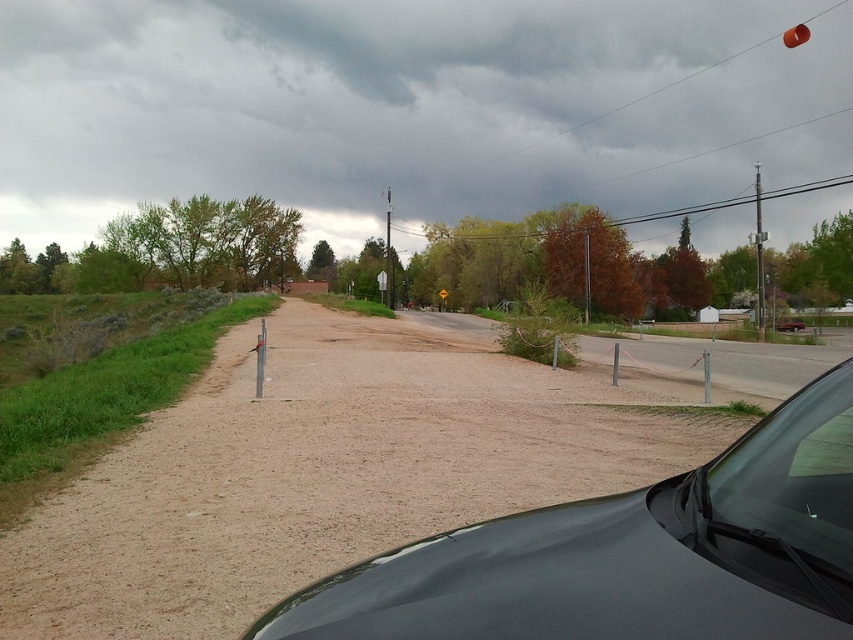
Between black glossy car at lower right and transparent glass windshield at lower right, which one appears on the right side from the viewer's perspective?

Positioned to the right is transparent glass windshield at lower right.

Who is positioned more to the left, black glossy car at lower right or transparent glass windshield at lower right?

black glossy car at lower right

Is point (508, 518) less distant than point (764, 486)?

No, it is not.

You are a GUI agent. You are given a task and a screenshot of the screen. Output one action in this format:
    pyautogui.click(x=<x>, y=<y>)
    Task: Click on the black glossy car at lower right
    The image size is (853, 640).
    Given the screenshot: What is the action you would take?
    pyautogui.click(x=631, y=554)